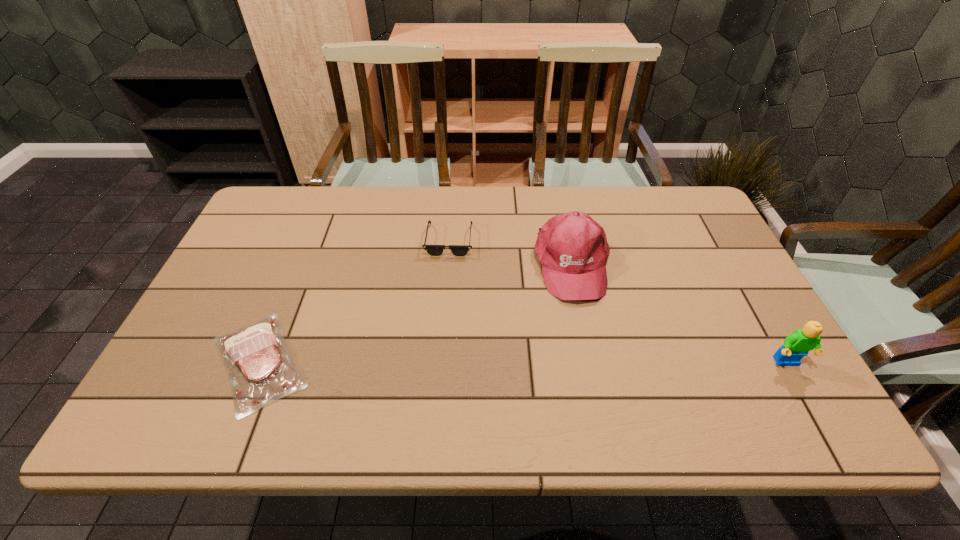
The height and width of the screenshot is (540, 960). Find the location of `free location located at the front of the third object from left to right with the brim`. free location located at the front of the third object from left to right with the brim is located at coordinates coord(590,344).

The width and height of the screenshot is (960, 540). I want to click on free space located at the front of the third object from left to right with the brim, so click(588, 334).

In order to click on vacant space situated 0.220m at the front of the third object from left to right with the brim in this screenshot , I will do [599, 381].

Where is `sunglasses located in the far edge section of the desktop`? sunglasses located in the far edge section of the desktop is located at coordinates (433, 250).

The width and height of the screenshot is (960, 540). What are the coordinates of `baseball cap located in the far edge section of the desktop` in the screenshot? It's located at (572, 249).

Identify the location of steak located in the near edge section of the desktop. (261, 370).

Where is `Lego that is positioned at the near edge`? The width and height of the screenshot is (960, 540). Lego that is positioned at the near edge is located at coordinates (797, 345).

Where is `object that is at the left edge`? object that is at the left edge is located at coordinates (261, 370).

Image resolution: width=960 pixels, height=540 pixels. Find the location of `object located at the right edge`. object located at the right edge is located at coordinates (797, 345).

You are a GUI agent. You are given a task and a screenshot of the screen. Output one action in this format:
    pyautogui.click(x=<x>, y=<y>)
    Task: Click on the object situated at the near left corner
    The height and width of the screenshot is (540, 960).
    Given the screenshot: What is the action you would take?
    pyautogui.click(x=261, y=370)